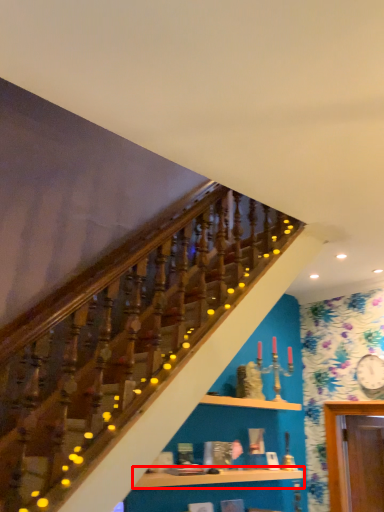
Question: From the image, what is the correct spatial relationship of shelf (annotated by the red box) in relation to shelf?

Choices:
 (A) right
 (B) left

Answer: (B)